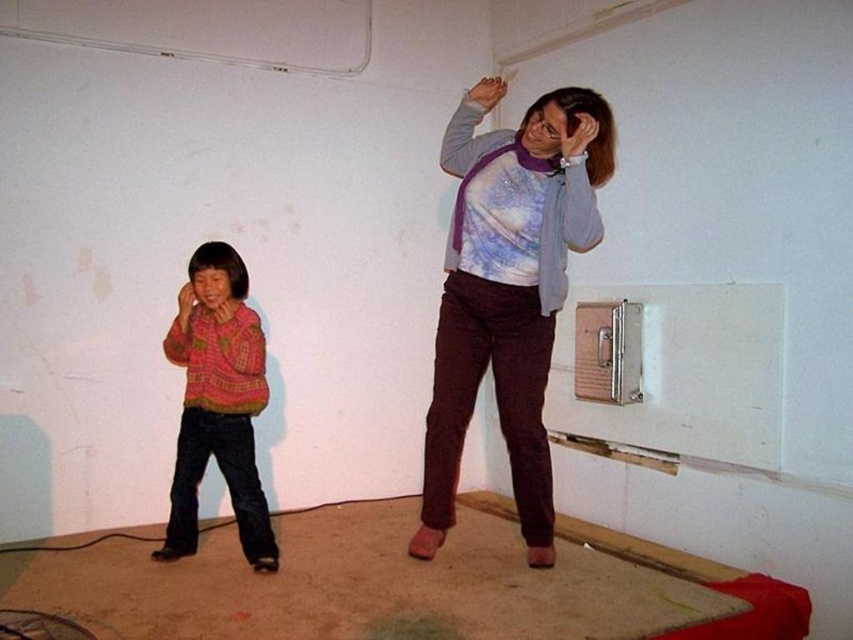
Does purple soft scarf at upper center lie behind knitted sweater at left?

No, it is in front of knitted sweater at left.

Based on the photo, which of these two, purple soft scarf at upper center or knitted sweater at left, stands taller?

With more height is purple soft scarf at upper center.

Between point (508, 218) and point (250, 308), which one is positioned behind?

The point (250, 308) is behind.

Locate an element on the screen. This screenshot has height=640, width=853. purple soft scarf at upper center is located at coordinates (509, 289).